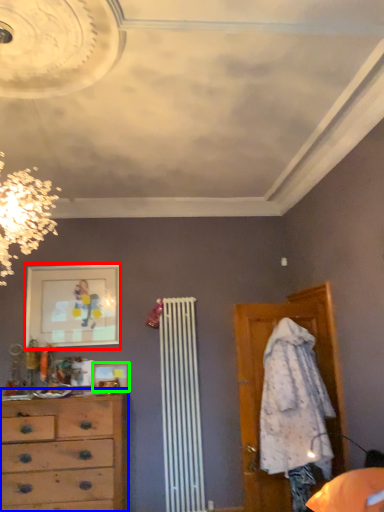
Question: Estimate the real-world distances between objects in this image. Which object is closer to picture frame (highlighted by a red box), chest of drawers (highlighted by a blue box) or picture frame (highlighted by a green box)?

Choices:
 (A) chest of drawers
 (B) picture frame

Answer: (B)